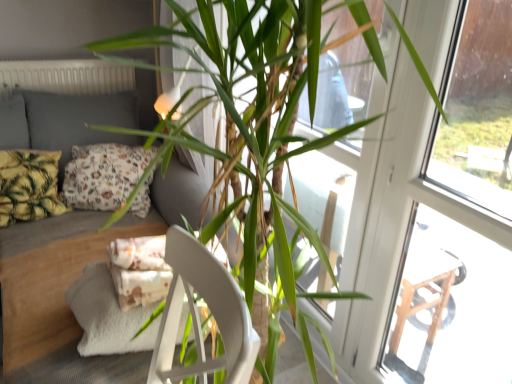
What do you see at coordinates (66, 77) in the screenshot? I see `white matte radiator at upper left` at bounding box center [66, 77].

At what (x,y) coordinates should I click in order to perform the action: click on gray fabric couch at left. Please return your answer as a coordinate pair (x, y). This screenshot has width=512, height=384. Looking at the image, I should click on (73, 281).

At what (x,y) coordinates should I click in order to perform the action: click on floral fabric pillow at left, the first pillow viewed from the right. Please return your answer as a coordinate pair (x, y). Looking at the image, I should click on (103, 175).

Between white matte radiator at upper left and floral fabric pillow at left, marked as the 2th pillow in a left-to-right arrangement, which one appears on the left side from the viewer's perspective?

white matte radiator at upper left.

In the scene shown: Is white matte radiator at upper left aimed at floral fabric pillow at left, marked as the 2th pillow in a left-to-right arrangement?

No, white matte radiator at upper left is not turned towards floral fabric pillow at left, marked as the 2th pillow in a left-to-right arrangement.

Is white matte radiator at upper left wider or thinner than floral fabric pillow at left, marked as the 2th pillow in a left-to-right arrangement?

Clearly, white matte radiator at upper left has less width compared to floral fabric pillow at left, marked as the 2th pillow in a left-to-right arrangement.

Considering their positions, is white matte radiator at upper left located in front of or behind floral fabric pillow at left, the first pillow viewed from the right?

Visually, white matte radiator at upper left is located behind floral fabric pillow at left, the first pillow viewed from the right.

From the image's perspective, which one is positioned lower, yellow-green leafy fabric pillow at left, acting as the 1th pillow starting from the left, or transparent glass screen door at upper right?

transparent glass screen door at upper right appears lower in the image.

Is yellow-green leafy fabric pillow at left, positioned as the 2th pillow in right-to-left order, to the left or to the right of transparent glass screen door at upper right in the image?

From the image, it's evident that yellow-green leafy fabric pillow at left, positioned as the 2th pillow in right-to-left order, is to the left of transparent glass screen door at upper right.

Is yellow-green leafy fabric pillow at left, acting as the 1th pillow starting from the left, far from transparent glass screen door at upper right?

yellow-green leafy fabric pillow at left, acting as the 1th pillow starting from the left, is positioned a significant distance from transparent glass screen door at upper right.

Considering the relative sizes of yellow-green leafy fabric pillow at left, acting as the 1th pillow starting from the left, and transparent glass screen door at upper right in the image provided, is yellow-green leafy fabric pillow at left, acting as the 1th pillow starting from the left, smaller than transparent glass screen door at upper right?

Yes, yellow-green leafy fabric pillow at left, acting as the 1th pillow starting from the left, is smaller than transparent glass screen door at upper right.

Are gray fabric couch at left and transparent glass screen door at upper right far apart?

gray fabric couch at left is positioned a significant distance from transparent glass screen door at upper right.

Which point is more forward, (11, 324) or (477, 184)?

The point (477, 184) is closer.

From the image's perspective, is gray fabric couch at left located beneath transparent glass screen door at upper right?

No.

From the image's perspective, between floral fabric pillow at left, marked as the 2th pillow in a left-to-right arrangement, and white matte radiator at upper left, which one is located above?

white matte radiator at upper left.

Which is more to the right, floral fabric pillow at left, the first pillow viewed from the right, or white matte radiator at upper left?

Positioned to the right is floral fabric pillow at left, the first pillow viewed from the right.

Is point (135, 154) farther from camera compared to point (84, 69)?

No, it is in front of (84, 69).

The image size is (512, 384). What are the coordinates of `pillow below the floral fabric pillow at left, the first pillow viewed from the right (from the image's perspective)` in the screenshot? It's located at (29, 185).

From the image's perspective, is floral fabric pillow at left, the first pillow viewed from the right, on yellow-green leafy fabric pillow at left, acting as the 1th pillow starting from the left?

Yes.

Is floral fabric pillow at left, the first pillow viewed from the right, taller or shorter than yellow-green leafy fabric pillow at left, positioned as the 2th pillow in right-to-left order?

Considering their sizes, floral fabric pillow at left, the first pillow viewed from the right, has less height than yellow-green leafy fabric pillow at left, positioned as the 2th pillow in right-to-left order.

Looking at this image, from a real-world perspective, is floral fabric pillow at left, marked as the 2th pillow in a left-to-right arrangement, located higher than yellow-green leafy fabric pillow at left, acting as the 1th pillow starting from the left?

Yes, from a real-world perspective, floral fabric pillow at left, marked as the 2th pillow in a left-to-right arrangement, is on top of yellow-green leafy fabric pillow at left, acting as the 1th pillow starting from the left.

From the image's perspective, is yellow-green leafy fabric pillow at left, positioned as the 2th pillow in right-to-left order, on floral fabric pillow at left, the first pillow viewed from the right?

Actually, yellow-green leafy fabric pillow at left, positioned as the 2th pillow in right-to-left order, appears below floral fabric pillow at left, the first pillow viewed from the right, in the image.

Is yellow-green leafy fabric pillow at left, acting as the 1th pillow starting from the left, facing away from floral fabric pillow at left, marked as the 2th pillow in a left-to-right arrangement?

No, yellow-green leafy fabric pillow at left, acting as the 1th pillow starting from the left, is not facing the opposite direction of floral fabric pillow at left, marked as the 2th pillow in a left-to-right arrangement.

Could you measure the distance between yellow-green leafy fabric pillow at left, positioned as the 2th pillow in right-to-left order, and floral fabric pillow at left, the first pillow viewed from the right?

A: The distance of yellow-green leafy fabric pillow at left, positioned as the 2th pillow in right-to-left order, from floral fabric pillow at left, the first pillow viewed from the right, is 7.01 inches.

Are yellow-green leafy fabric pillow at left, positioned as the 2th pillow in right-to-left order, and floral fabric pillow at left, the first pillow viewed from the right, making contact?

They are not placed beside each other.

In terms of width, does transparent glass screen door at upper right look wider or thinner when compared to yellow-green leafy fabric pillow at left, acting as the 1th pillow starting from the left?

In the image, transparent glass screen door at upper right appears to be more narrow than yellow-green leafy fabric pillow at left, acting as the 1th pillow starting from the left.

I want to click on the 2nd pillow to the left of the transparent glass screen door at upper right, starting your count from the anchor, so click(x=29, y=185).

Which is behind, point (347, 365) or point (12, 205)?

Point (12, 205)

At what (x,y) coordinates should I click in order to perform the action: click on the 1st pillow in front of the white matte radiator at upper left. Please return your answer as a coordinate pair (x, y). This screenshot has height=384, width=512. Looking at the image, I should click on (103, 175).

The height and width of the screenshot is (384, 512). In the image, there is a yellow-green leafy fabric pillow at left, positioned as the 2th pillow in right-to-left order. What are the coordinates of `screen door below it (from the image's perspective)` in the screenshot? It's located at (440, 208).

Based on their spatial positions, is white matte radiator at upper left or floral fabric pillow at left, the first pillow viewed from the right, further from yellow-green leafy fabric pillow at left, acting as the 1th pillow starting from the left?

white matte radiator at upper left is further to yellow-green leafy fabric pillow at left, acting as the 1th pillow starting from the left.

Which object lies further to the anchor point floral fabric pillow at left, marked as the 2th pillow in a left-to-right arrangement, gray fabric couch at left or yellow-green leafy fabric pillow at left, positioned as the 2th pillow in right-to-left order?

gray fabric couch at left.

Which object lies nearer to the anchor point transparent glass screen door at upper right, gray fabric couch at left or yellow-green leafy fabric pillow at left, acting as the 1th pillow starting from the left?

gray fabric couch at left lies closer to transparent glass screen door at upper right than the other object.

Considering their positions, is yellow-green leafy fabric pillow at left, acting as the 1th pillow starting from the left, positioned further to transparent glass screen door at upper right than white matte radiator at upper left?

white matte radiator at upper left is further to transparent glass screen door at upper right.

Considering their positions, is floral fabric pillow at left, the first pillow viewed from the right, positioned closer to gray fabric couch at left than white matte radiator at upper left?

Among the two, floral fabric pillow at left, the first pillow viewed from the right, is located nearer to gray fabric couch at left.

When comparing their distances from yellow-green leafy fabric pillow at left, positioned as the 2th pillow in right-to-left order, does floral fabric pillow at left, marked as the 2th pillow in a left-to-right arrangement, or transparent glass screen door at upper right seem further?

transparent glass screen door at upper right.

When comparing their distances from white matte radiator at upper left, does transparent glass screen door at upper right or floral fabric pillow at left, the first pillow viewed from the right, seem closer?

The object closer to white matte radiator at upper left is floral fabric pillow at left, the first pillow viewed from the right.

Considering their positions, is transparent glass screen door at upper right positioned closer to floral fabric pillow at left, marked as the 2th pillow in a left-to-right arrangement, than white matte radiator at upper left?

white matte radiator at upper left.

This screenshot has height=384, width=512. Find the location of `studio couch situated between yellow-green leafy fabric pillow at left, positioned as the 2th pillow in right-to-left order, and transparent glass screen door at upper right from left to right`. studio couch situated between yellow-green leafy fabric pillow at left, positioned as the 2th pillow in right-to-left order, and transparent glass screen door at upper right from left to right is located at coordinates (73, 281).

Identify the location of pillow between white matte radiator at upper left and transparent glass screen door at upper right in the horizontal direction. (103, 175).

This screenshot has height=384, width=512. I want to click on studio couch between floral fabric pillow at left, marked as the 2th pillow in a left-to-right arrangement, and transparent glass screen door at upper right, so click(73, 281).

Locate an element on the screen. Image resolution: width=512 pixels, height=384 pixels. pillow located between yellow-green leafy fabric pillow at left, positioned as the 2th pillow in right-to-left order, and transparent glass screen door at upper right in the left-right direction is located at coordinates (103, 175).